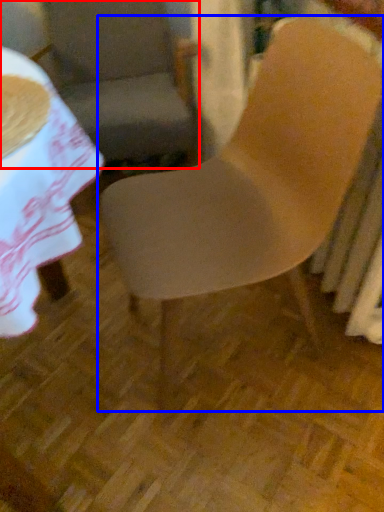
Question: Among these objects, which one is farthest to the camera, chair (highlighted by a red box) or chair (highlighted by a blue box)?

Choices:
 (A) chair
 (B) chair

Answer: (A)